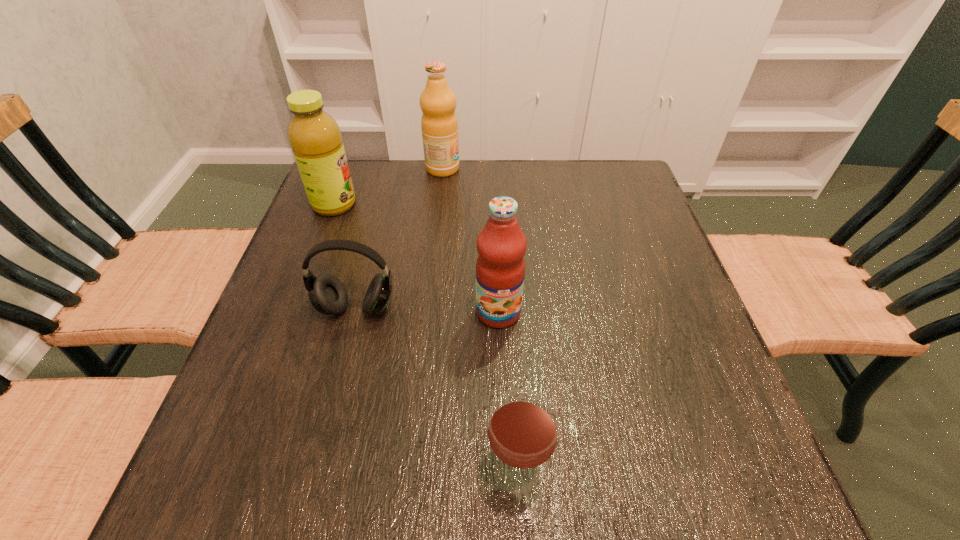
Choose which object is the third nearest neighbor to the headset. Please provide its 2D coordinates. Your answer should be formatted as a tuple, i.e. [(x, y)], where the tuple contains the x and y coordinates of a point satisfying the conditions above.

[(523, 425)]

Identify which fruit juice is the second nearest to the headset. Please provide its 2D coordinates. Your answer should be formatted as a tuple, i.e. [(x, y)], where the tuple contains the x and y coordinates of a point satisfying the conditions above.

[(315, 138)]

You are a GUI agent. You are given a task and a screenshot of the screen. Output one action in this format:
    pyautogui.click(x=<x>, y=<y>)
    Task: Click on the fruit juice that is the second closest one to the wineglass
    The height and width of the screenshot is (540, 960).
    Given the screenshot: What is the action you would take?
    pyautogui.click(x=315, y=138)

This screenshot has height=540, width=960. I want to click on vacant position in the image that satisfies the following two spatial constraints: 1. on the front label of the second farthest object; 2. on the back side of the nearest object, so click(233, 471).

Locate an element on the screen. The width and height of the screenshot is (960, 540). vacant point that satisfies the following two spatial constraints: 1. on the ear cups of the wineglass; 2. on the right side of the headset is located at coordinates (315, 471).

Locate an element on the screen. blank area in the image that satisfies the following two spatial constraints: 1. on the back side of the nearest object; 2. on the front label of the fourth nearest object is located at coordinates (501, 205).

Where is `free spot that satisfies the following two spatial constraints: 1. on the front label of the leftmost fruit juice; 2. on the back side of the wineglass`? free spot that satisfies the following two spatial constraints: 1. on the front label of the leftmost fruit juice; 2. on the back side of the wineglass is located at coordinates click(233, 471).

You are a GUI agent. You are given a task and a screenshot of the screen. Output one action in this format:
    pyautogui.click(x=<x>, y=<y>)
    Task: Click on the free location that satisfies the following two spatial constraints: 1. on the front label of the second farthest object; 2. on the right side of the wineglass
    This screenshot has width=960, height=540.
    Given the screenshot: What is the action you would take?
    pyautogui.click(x=233, y=471)

Find the location of a particular element. The width and height of the screenshot is (960, 540). free region that satisfies the following two spatial constraints: 1. on the front label of the wineglass; 2. on the left side of the farthest object is located at coordinates (410, 471).